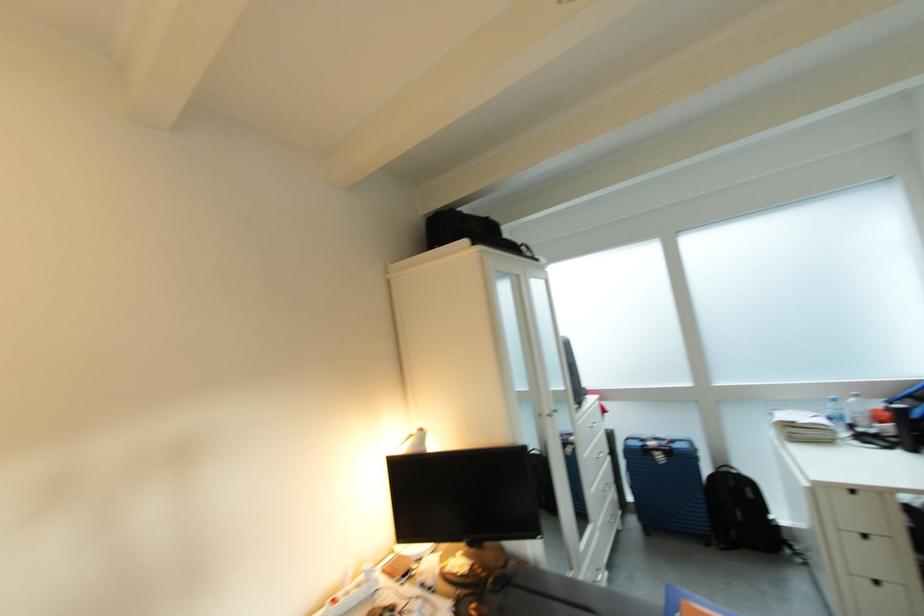
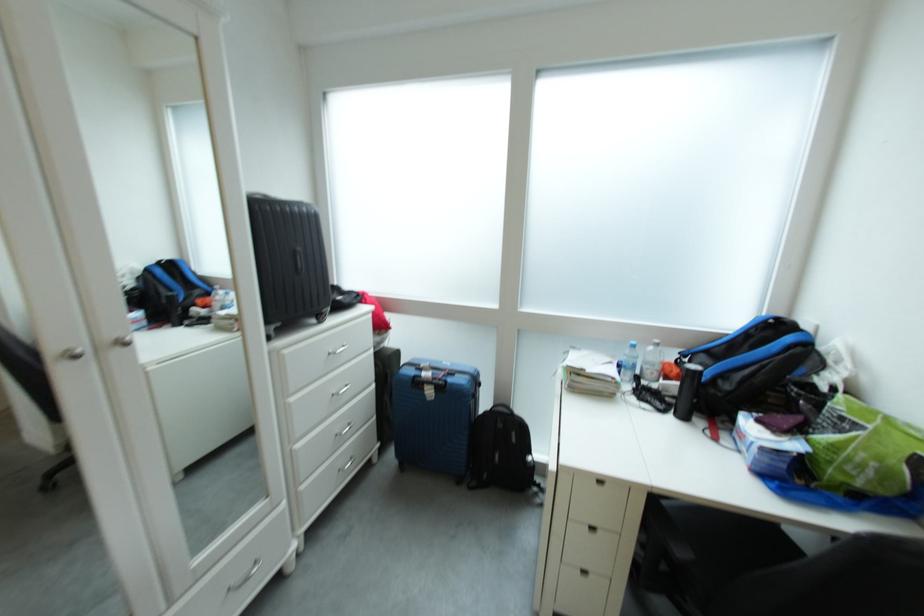
Locate, in the second image, the point that corresponds to point (664, 459) in the first image.

(434, 392)